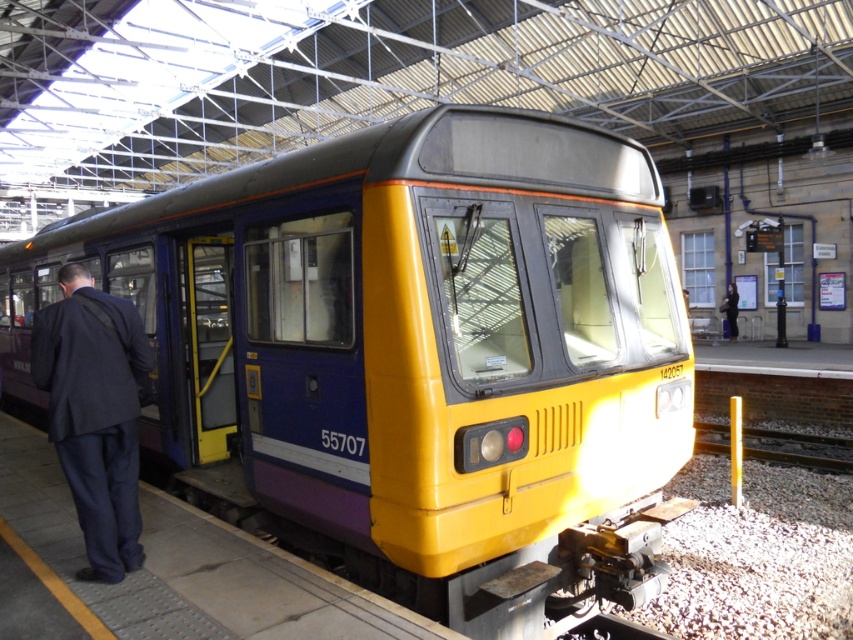
Question: Which point appears closest to the camera in this image?

Choices:
 (A) pos(120,536)
 (B) pos(705,440)
 (C) pos(257,186)

Answer: (A)

Question: Does dark blue suit at left appear on the right side of metallic gray train track at right?

Choices:
 (A) yes
 (B) no

Answer: (B)

Question: Which of the following is the farthest from the observer?

Choices:
 (A) (80, 276)
 (B) (482, 484)
 (C) (704, 444)

Answer: (C)

Question: Which object is positioned farthest from the yellow matte train at center?

Choices:
 (A) dark blue suit at left
 (B) metallic gray train track at right

Answer: (B)

Question: Does dark blue suit at left have a larger size compared to metallic gray train track at right?

Choices:
 (A) no
 (B) yes

Answer: (A)

Question: Can you confirm if dark blue suit at left is positioned above metallic gray train track at right?

Choices:
 (A) no
 (B) yes

Answer: (B)